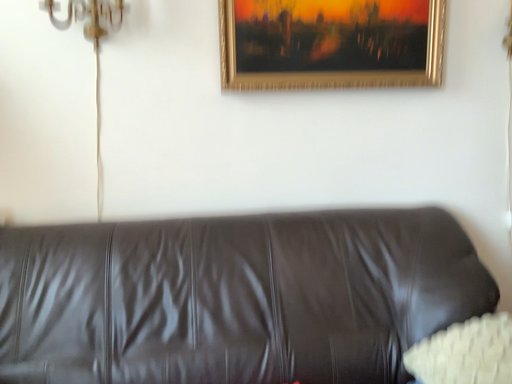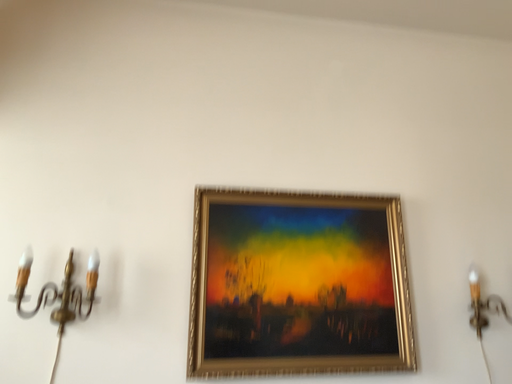
Question: Which way did the camera rotate in the video?

Choices:
 (A) rotated downward
 (B) rotated upward

Answer: (B)